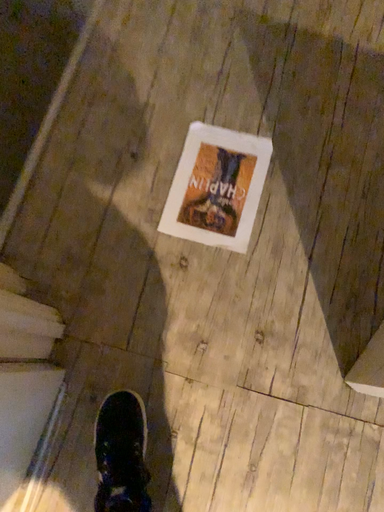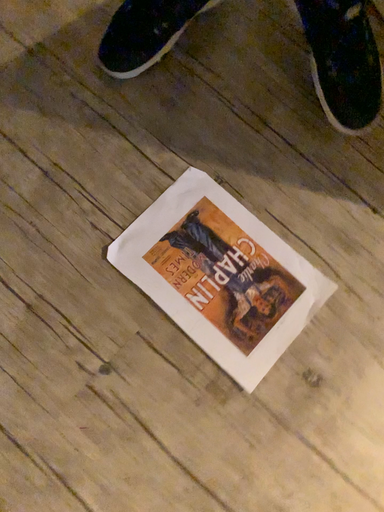
Question: How did the camera likely rotate when shooting the video?

Choices:
 (A) rotated left
 (B) rotated right

Answer: (B)